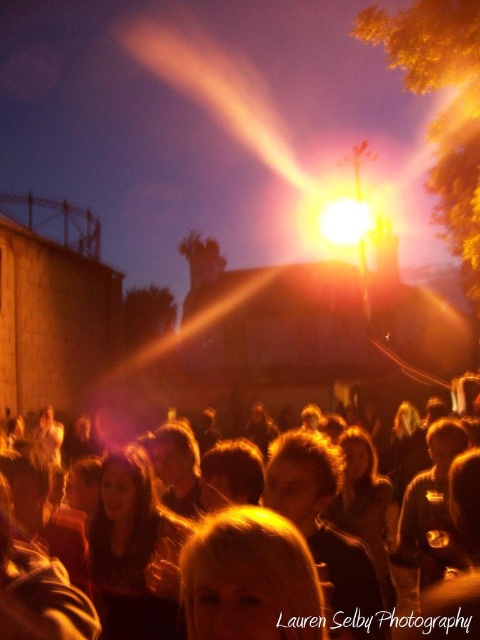
Which of these two, matte golden hair at center or bright yellow light at center, stands taller?

Standing taller between the two is matte golden hair at center.

Does matte golden hair at center have a lesser width compared to bright yellow light at center?

No.

Is point (275, 508) farther from viewer compared to point (335, 227)?

No, (275, 508) is closer to viewer.

This screenshot has height=640, width=480. I want to click on matte golden hair at center, so click(445, 502).